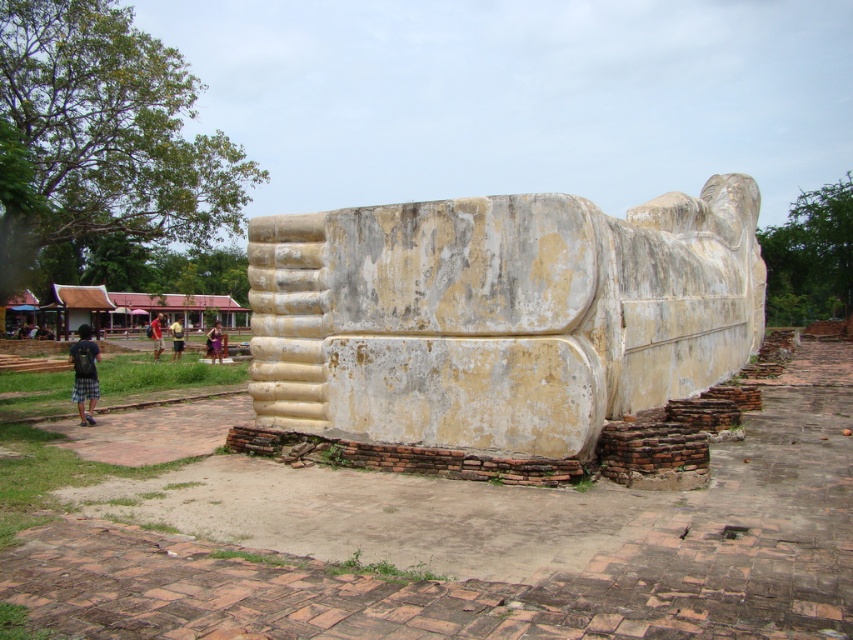
Who is positioned more to the right, light brown fabric shorts at center or light brown wooden stick at center?

light brown fabric shorts at center is more to the right.

Is light brown fabric shorts at center taller than light brown wooden stick at center?

In fact, light brown fabric shorts at center may be shorter than light brown wooden stick at center.

Is point (173, 337) closer to viewer compared to point (157, 356)?

That is False.

You are a GUI agent. You are given a task and a screenshot of the screen. Output one action in this format:
    pyautogui.click(x=<x>, y=<y>)
    Task: Click on the light brown fabric shorts at center
    The height and width of the screenshot is (640, 853).
    Given the screenshot: What is the action you would take?
    pyautogui.click(x=177, y=337)

Does point (666, 304) come in front of point (158, 348)?

That is True.

Does white stone statue at center come in front of light brown wooden stick at center?

Yes.

This screenshot has width=853, height=640. I want to click on white stone statue at center, so click(x=500, y=316).

Between white stone statue at center and light brown fabric shorts at center, which one appears on the right side from the viewer's perspective?

white stone statue at center

Does white stone statue at center come behind light brown fabric shorts at center?

No, white stone statue at center is closer to the viewer.

Who is more distant from viewer, (x=370, y=372) or (x=177, y=324)?

Positioned behind is point (x=177, y=324).

At what (x,y) coordinates should I click in order to perform the action: click on white stone statue at center. Please return your answer as a coordinate pair (x, y). Image resolution: width=853 pixels, height=640 pixels. Looking at the image, I should click on (500, 316).